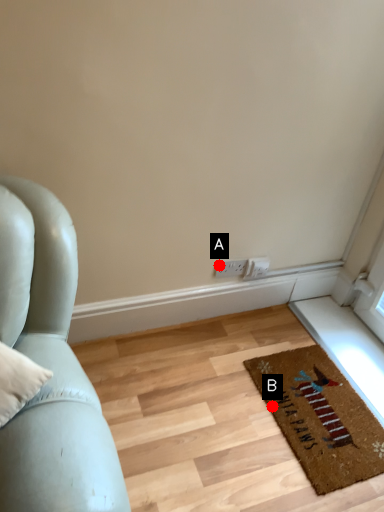
Question: Two points are circled on the image, labeled by A and B beside each circle. Which point appears farthest from the camera in this image?

Choices:
 (A) A is further
 (B) B is further

Answer: (A)